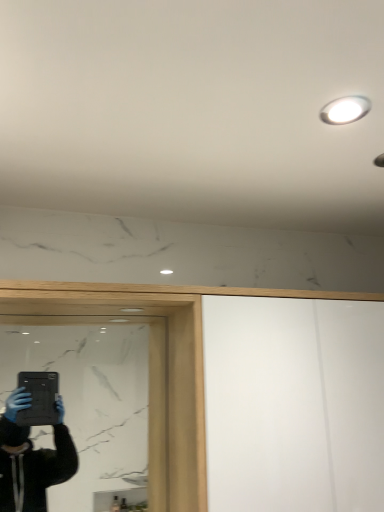
Question: Is black glass mirror at lower left bigger or smaller than white glossy light fixture at upper right?

Choices:
 (A) small
 (B) big

Answer: (B)

Question: In the image, is black glass mirror at lower left on the left side or the right side of white glossy light fixture at upper right?

Choices:
 (A) right
 (B) left

Answer: (B)

Question: From the image's perspective, relative to white glossy light fixture at upper right, is black glass mirror at lower left above or below?

Choices:
 (A) above
 (B) below

Answer: (B)

Question: Is white glossy light fixture at upper right wider or thinner than black glass mirror at lower left?

Choices:
 (A) thin
 (B) wide

Answer: (B)

Question: Is point (339, 105) closer or farther from the camera than point (135, 435)?

Choices:
 (A) farther
 (B) closer

Answer: (B)

Question: Considering their positions, is white glossy light fixture at upper right located in front of or behind black glass mirror at lower left?

Choices:
 (A) behind
 (B) front

Answer: (B)

Question: From the image's perspective, is white glossy light fixture at upper right above or below black glass mirror at lower left?

Choices:
 (A) above
 (B) below

Answer: (A)